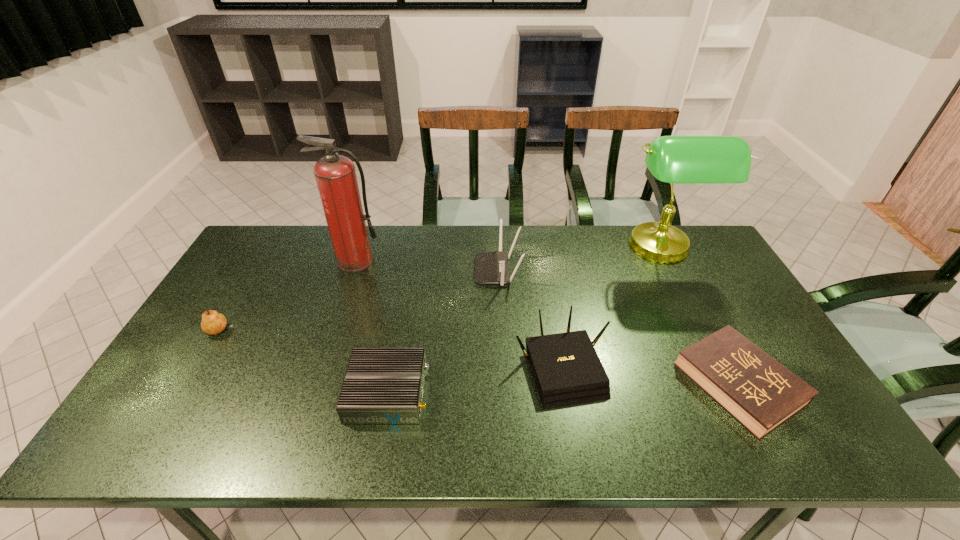
This screenshot has width=960, height=540. In order to click on empty space between the shortest object and the fire extinguisher in this screenshot , I will do `click(547, 323)`.

What are the coordinates of `unoccupied position between the hardback book and the fire extinguisher` in the screenshot? It's located at (547, 323).

The image size is (960, 540). I want to click on free space between the second object from left to right and the shortest router, so tap(372, 327).

This screenshot has height=540, width=960. I want to click on vacant space that is in between the fifth tallest object and the sixth object from right to left, so click(x=289, y=296).

You are a GUI agent. You are given a task and a screenshot of the screen. Output one action in this format:
    pyautogui.click(x=<x>, y=<y>)
    Task: Click on the object identified as the fourth closest to the leftmost object
    This screenshot has width=960, height=540.
    Given the screenshot: What is the action you would take?
    pyautogui.click(x=566, y=368)

Identify which object is the second nearest to the tallest router. Please provide its 2D coordinates. Your answer should be formatted as a tuple, i.e. [(x, y)], where the tuple contains the x and y coordinates of a point satisfying the conditions above.

[(382, 385)]

The width and height of the screenshot is (960, 540). What are the coordinates of `router that is the closest to the sixth object from right to left` in the screenshot? It's located at (490, 267).

This screenshot has height=540, width=960. Find the location of `the closest router to the lamp`. the closest router to the lamp is located at coordinates (566, 368).

Locate an element on the screen. free location that satisfies the following two spatial constraints: 1. at the nozzle of the second object from left to right; 2. on the right side of the fourth shortest object is located at coordinates (321, 368).

Where is `vacant space that satisfies the following two spatial constraints: 1. on the front side of the hardback book; 2. on the right side of the fourth shortest object`? vacant space that satisfies the following two spatial constraints: 1. on the front side of the hardback book; 2. on the right side of the fourth shortest object is located at coordinates (564, 384).